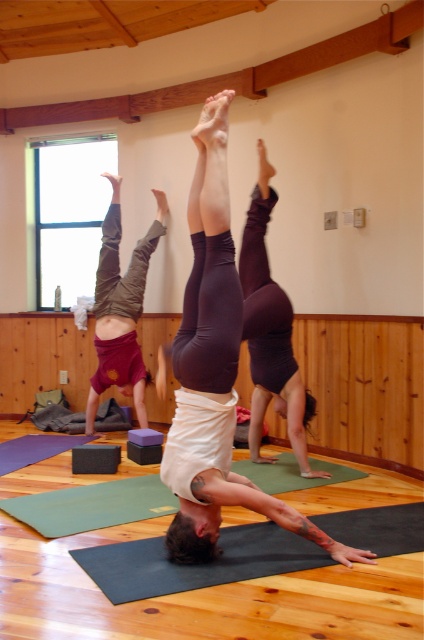
Question: Among these objects, which one is farthest from the camera?

Choices:
 (A) maroon fabric shorts at left
 (B) dark purple leggings at center

Answer: (A)

Question: Which point is closer to the camera?

Choices:
 (A) dark purple leggings at center
 (B) wooden beam at upper center
 (C) dark gray rubber yoga mat at center
 (D) maroon fabric shorts at left

Answer: (C)

Question: Which point is farther from the camera taking this photo?

Choices:
 (A) (265, 396)
 (B) (111, 268)
 (C) (370, 35)

Answer: (B)

Question: Can you confirm if dark purple leggings at center is smaller than maroon fabric shorts at left?

Choices:
 (A) yes
 (B) no

Answer: (A)

Question: Is wooden beam at upper center to the right of maroon fabric shorts at left from the viewer's perspective?

Choices:
 (A) no
 (B) yes

Answer: (B)

Question: Is dark gray rubber yoga mat at center further to the viewer compared to wooden beam at upper center?

Choices:
 (A) yes
 (B) no

Answer: (B)